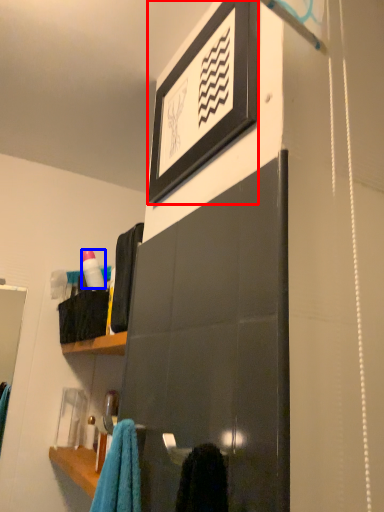
Question: Which object is closer to the camera taking this photo, picture frame (highlighted by a red box) or bottle (highlighted by a blue box)?

Choices:
 (A) picture frame
 (B) bottle

Answer: (A)